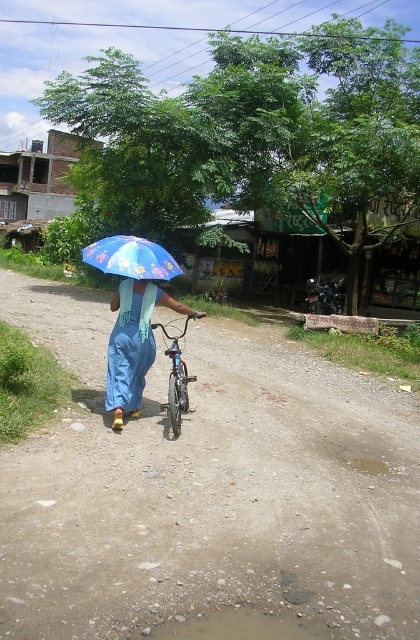
You are the person in the image holding the blue printed umbrella at center and pushing the shiny metallic bicycle at center. The sun is shining brightly. Which object is casting a shadow over the bicycle?

The blue printed umbrella at center is positioned over the shiny metallic bicycle at center, so it is casting a shadow over the bicycle.

You are a photographer trying to capture the scene with the blue fabric umbrella at center and the shiny metallic bicycle at center. If you want to ensure both objects are clearly visible in your photo, which object should you focus on first considering their sizes?

The blue fabric umbrella at center is larger than the shiny metallic bicycle at center, so focusing on the umbrella first would help ensure both objects are clearly visible in the photo.

You are a delivery person who needs to carry both the blue fabric umbrella at center and the blue printed umbrella at center. Given that your backpack has a maximum width of 80 centimeters, can you fit both umbrellas side by side in your backpack?

The distance between the blue fabric umbrella at center and blue printed umbrella at center is 79.23 centimeters, which is less than the backpack width of 80 centimeters. Therefore, you can fit both umbrellas side by side in your backpack.